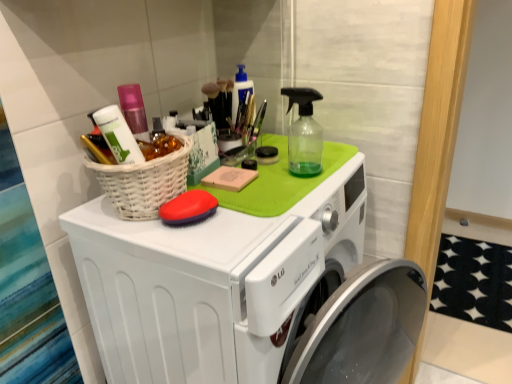
At what (x,y) coordinates should I click in order to perform the action: click on vacant area that lies in front of white wicker basket at upper left. Please return your answer as a coordinate pair (x, y). The height and width of the screenshot is (384, 512). Looking at the image, I should click on (172, 248).